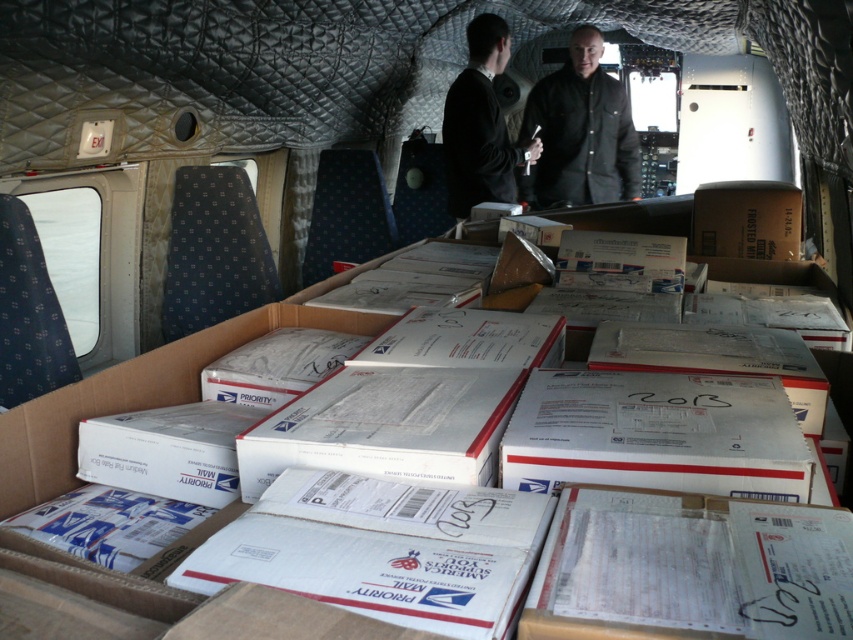
You are a delivery worker inside the cargo plane and need to locate the black matte jacket at center. According to the coordinates provided, where exactly should you look for it?

The black matte jacket at center is located at point coordinates (579,132).

You are a delivery worker who needs to retrieve the black matte suit at center from the cargo plane. The black matte jacket at center is blocking access to it. Can you move the jacket to get to the suit?

The black matte jacket at center is above the black matte suit at center, so you can move the jacket downward to access the suit.

You are a delivery person who needs to retrieve both the black matte jacket at center and the black matte suit at center from the cargo plane. Which item should you reach for first to access the other one?

The black matte jacket at center is closer to you than the black matte suit at center, so you should reach for the black matte jacket at center first to access the black matte suit at center behind it.